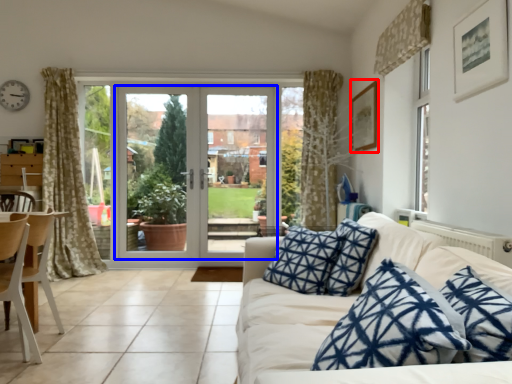
Question: Which point is closer to the camera, picture frame (highlighted by a red box) or door (highlighted by a blue box)?

Choices:
 (A) picture frame
 (B) door

Answer: (A)